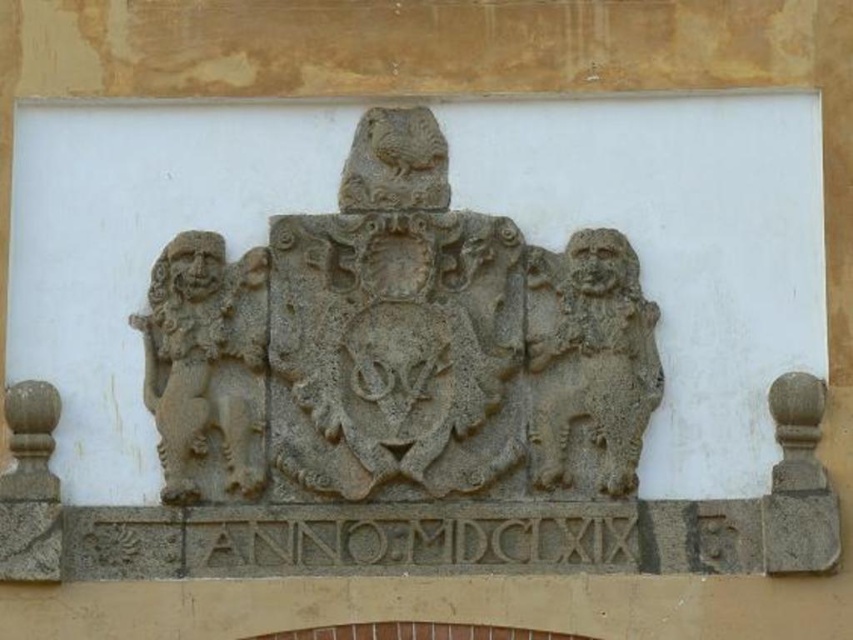
Question: Does gray stone lion at left have a larger size compared to gray stone lion at right?

Choices:
 (A) yes
 (B) no

Answer: (B)

Question: Is gray stone coat of arms at center bigger than gray stone lion at right?

Choices:
 (A) yes
 (B) no

Answer: (A)

Question: Which point is farther to the camera?

Choices:
 (A) (223, 420)
 (B) (534, 388)
 (C) (621, 486)

Answer: (B)

Question: In this image, where is gray stone coat of arms at center located relative to gray stone lion at right?

Choices:
 (A) left
 (B) right

Answer: (A)

Question: Which point is closer to the camera?

Choices:
 (A) gray stone lion at right
 (B) gray stone coat of arms at center

Answer: (B)

Question: Which object is positioned farthest from the gray stone coat of arms at center?

Choices:
 (A) gray stone lion at right
 (B) gray stone lion at left

Answer: (A)